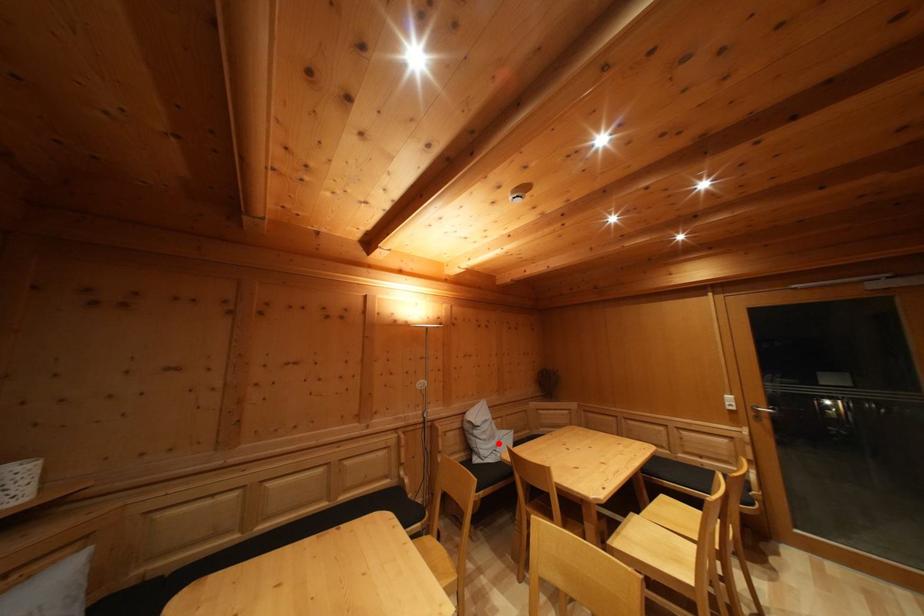
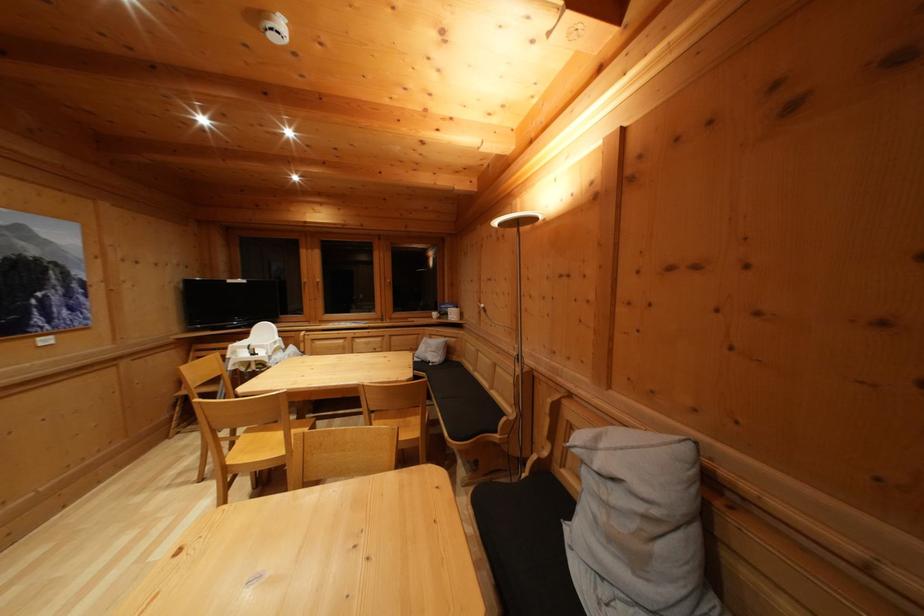
Question: I am providing you with two images of the same scene from different viewpoints. In image1, a red point is highlighted. Considering the same 3D point in image2, which of the following is correct?

Choices:
 (A) It is closer
 (B) It is farther

Answer: (A)